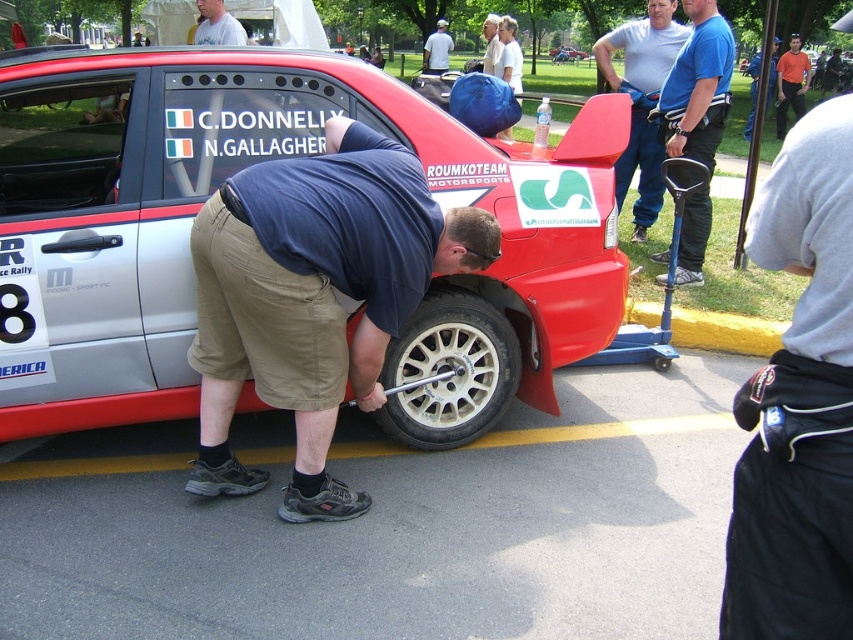
Between matte black tire at lower center and light blue shirt at center, which one appears on the left side from the viewer's perspective?

matte black tire at lower center

Does matte black tire at lower center have a larger size compared to light blue shirt at center?

No, matte black tire at lower center is not bigger than light blue shirt at center.

Does point (282, 276) lie in front of point (485, 54)?

Yes.

The width and height of the screenshot is (853, 640). Find the location of `matte black tire at lower center`. matte black tire at lower center is located at coordinates (314, 298).

Is matte black tire at lower center below orange shirt at upper right?

Yes.

Is matte black tire at lower center positioned behind orange shirt at upper right?

No, it is in front of orange shirt at upper right.

Is point (386, 220) more distant than point (747, 67)?

No, it is in front of (747, 67).

Locate an element on the screen. The image size is (853, 640). matte black tire at lower center is located at coordinates (314, 298).

Can you confirm if white rubber tire at lower center is positioned to the right of orange shirt at center?

In fact, white rubber tire at lower center is to the left of orange shirt at center.

Which is more to the right, white rubber tire at lower center or orange shirt at center?

From the viewer's perspective, orange shirt at center appears more on the right side.

Who is more forward, (x=399, y=369) or (x=784, y=116)?

Point (x=399, y=369) is in front.

This screenshot has width=853, height=640. I want to click on white rubber tire at lower center, so 448,371.